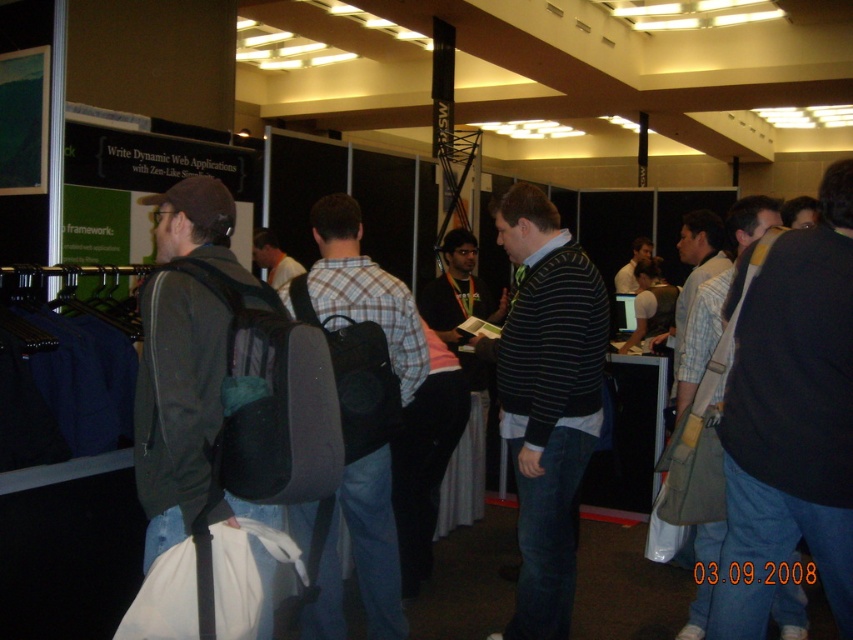
In the scene shown: Which is above, dark blue sweater at center or light blue shirt at center?

light blue shirt at center is above.

How far apart are dark blue sweater at center and light blue shirt at center?

A distance of 17.23 feet exists between dark blue sweater at center and light blue shirt at center.

Is point (808, 330) positioned behind point (624, 288)?

No, it is in front of (624, 288).

This screenshot has width=853, height=640. Find the location of `dark blue sweater at center`. dark blue sweater at center is located at coordinates (790, 420).

Who is positioned more to the right, plaid fabric shirt at center or light blue shirt at center?

light blue shirt at center

Who is more forward, (306, 314) or (625, 285)?

Point (306, 314) is in front.

I want to click on plaid fabric shirt at center, so click(x=360, y=412).

Can you confirm if plaid fabric shirt at center is thinner than dark gray backpack at left?

In fact, plaid fabric shirt at center might be wider than dark gray backpack at left.

Describe the element at coordinates (360, 412) in the screenshot. I see `plaid fabric shirt at center` at that location.

At what (x,y) coordinates should I click in order to perform the action: click on plaid fabric shirt at center. Please return your answer as a coordinate pair (x, y). Looking at the image, I should click on (360, 412).